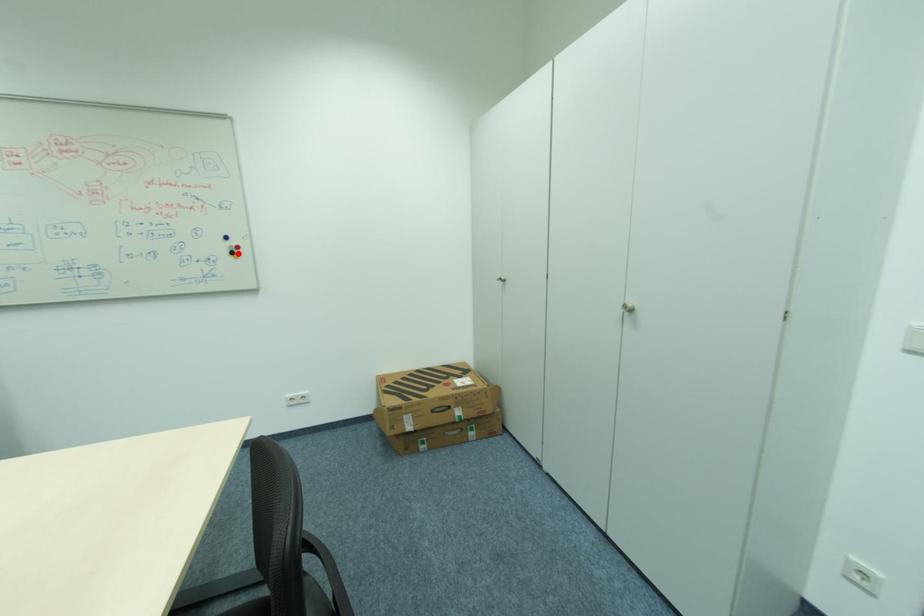
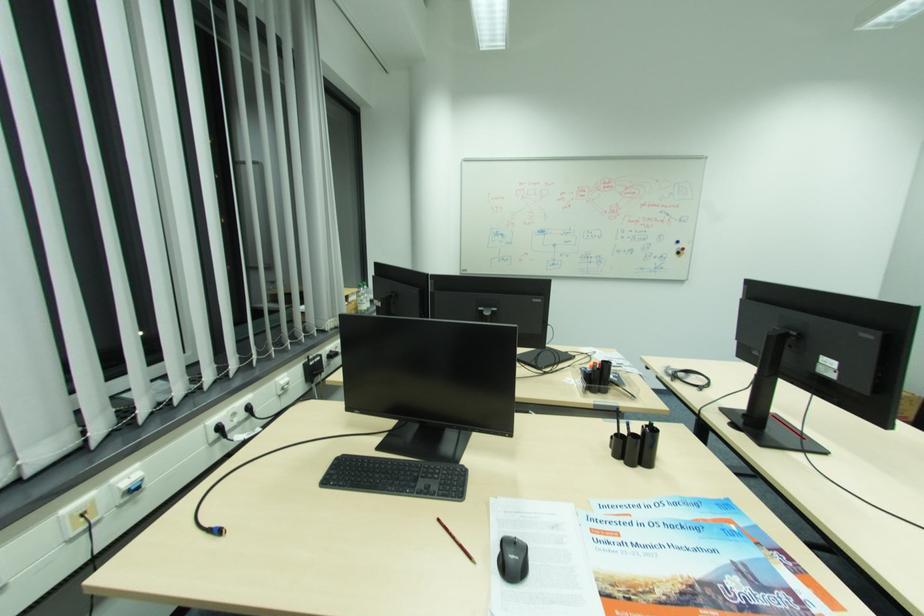
Locate, in the second image, the point that corresponds to the highlighted location in the first image.

(684, 253)